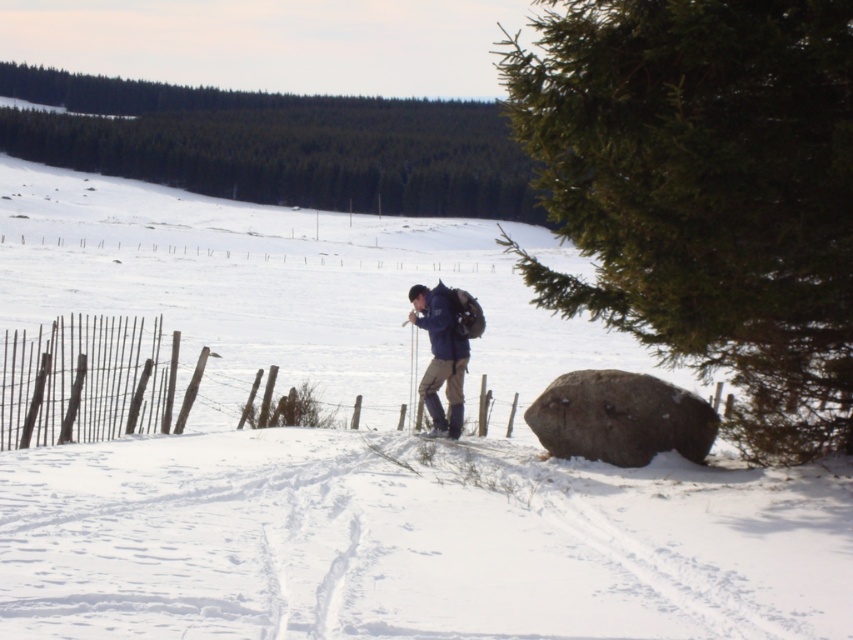
Question: Is brown rough boulder at lower right positioned behind dark blue jacket at center?

Choices:
 (A) yes
 (B) no

Answer: (B)

Question: Can you confirm if green textured rock at lower right is thinner than green matte tree at upper center?

Choices:
 (A) yes
 (B) no

Answer: (A)

Question: Which of the following is the farthest from the observer?

Choices:
 (A) dark blue jacket at center
 (B) green matte tree at upper center
 (C) brown rough boulder at lower right

Answer: (B)

Question: Which of the following is the closest to the observer?

Choices:
 (A) (26, 435)
 (B) (434, 428)

Answer: (A)

Question: Does green textured rock at lower right have a greater width compared to rusty wire fence at left?

Choices:
 (A) yes
 (B) no

Answer: (B)

Question: Considering the real-world distances, which object is farthest from the white powdery snow at center?

Choices:
 (A) black matte ski at center
 (B) brown rough boulder at lower right
 (C) rusty wire fence at left

Answer: (C)